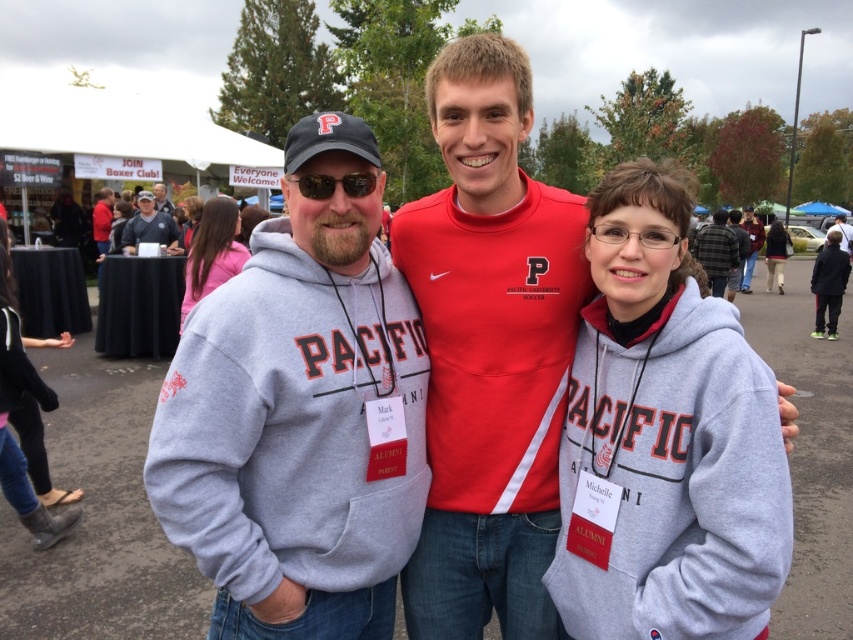
Based on the photo, who is shorter, dark gray hoodie at center or matte black cap at upper left?

matte black cap at upper left is shorter.

Does dark gray hoodie at center appear under matte black cap at upper left?

Correct, dark gray hoodie at center is located below matte black cap at upper left.

Is point (828, 234) farther from viewer compared to point (166, 211)?

No, (828, 234) is in front of (166, 211).

Identify the location of dark gray hoodie at center. This screenshot has width=853, height=640. (828, 284).

Is matte black sunglasses at center above matte black cap at upper left?

Actually, matte black sunglasses at center is below matte black cap at upper left.

Who is more forward, [341,179] or [160,192]?

Point [341,179] is in front.

Which is in front, point (321, 182) or point (161, 193)?

Positioned in front is point (321, 182).

Locate an element on the screen. The image size is (853, 640). matte black sunglasses at center is located at coordinates (334, 184).

Which of these two, matte red hoodie at center or maroon leather jacket at center, stands taller?

Standing taller between the two is maroon leather jacket at center.

Can you confirm if matte red hoodie at center is positioned to the right of maroon leather jacket at center?

In fact, matte red hoodie at center is to the left of maroon leather jacket at center.

At what (x,y) coordinates should I click in order to perform the action: click on matte red hoodie at center. Please return your answer as a coordinate pair (x, y). Looking at the image, I should click on (664, 440).

Where is `matte red hoodie at center`? The width and height of the screenshot is (853, 640). matte red hoodie at center is located at coordinates (664, 440).